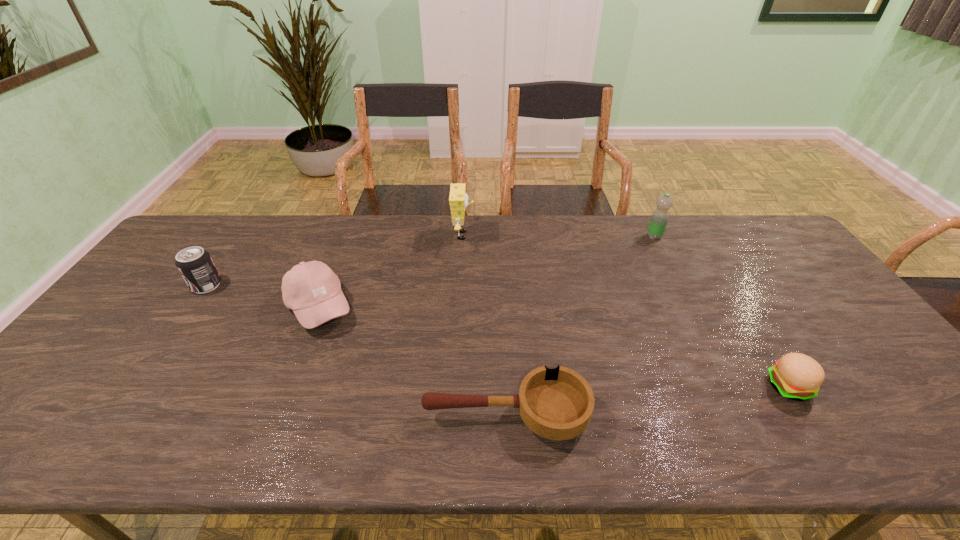
Image resolution: width=960 pixels, height=540 pixels. Identify the location of free space located on the right of the hamburger. (860, 387).

Where is `free location located 0.220m with the handle on the side of the saucepan`? The height and width of the screenshot is (540, 960). free location located 0.220m with the handle on the side of the saucepan is located at coordinates (325, 415).

Locate an element on the screen. vacant space situated 0.170m with the handle on the side of the saucepan is located at coordinates (348, 415).

Where is `vacant space situated 0.300m with the handle on the side of the saucepan`? The width and height of the screenshot is (960, 540). vacant space situated 0.300m with the handle on the side of the saucepan is located at coordinates (290, 415).

The height and width of the screenshot is (540, 960). Find the location of `sponge that is positioned at the far edge`. sponge that is positioned at the far edge is located at coordinates (458, 199).

Locate an element on the screen. Image resolution: width=960 pixels, height=540 pixels. water bottle located in the far edge section of the desktop is located at coordinates (658, 222).

At what (x,y) coordinates should I click in order to perform the action: click on object present at the near edge. Please return your answer as a coordinate pair (x, y). The image size is (960, 540). Looking at the image, I should click on (557, 404).

The width and height of the screenshot is (960, 540). In order to click on object that is at the left edge in this screenshot , I will do (195, 265).

Locate an element on the screen. Image resolution: width=960 pixels, height=540 pixels. vacant region at the far edge of the desktop is located at coordinates (412, 220).

Locate an element on the screen. The width and height of the screenshot is (960, 540). free space at the right edge of the desktop is located at coordinates (810, 328).